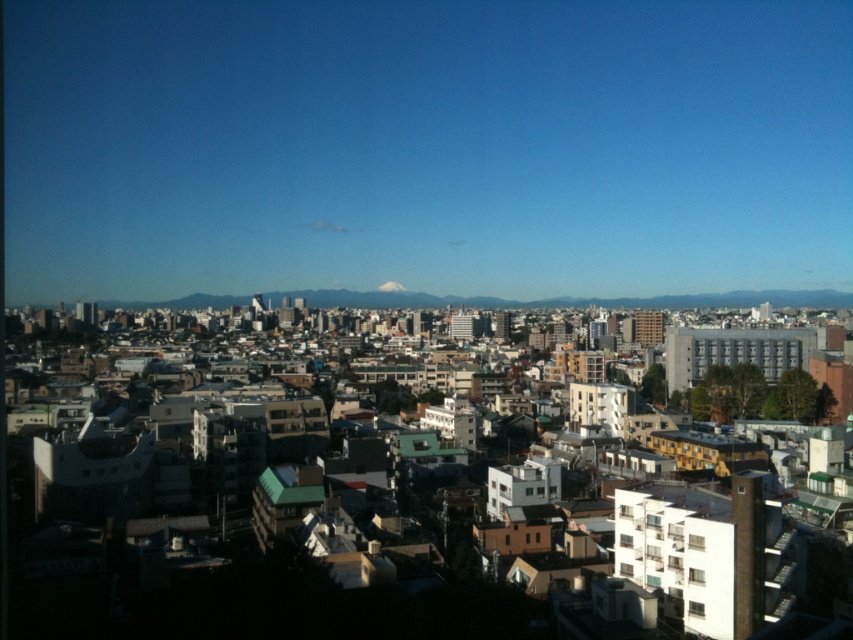
Between point (410, 493) and point (383, 284), which one is positioned in front?

Point (410, 493)

At what (x,y) coordinates should I click in order to perform the action: click on white matte building at center. Please return your answer as a coordinate pair (x, y). Looking at the image, I should click on (236, 592).